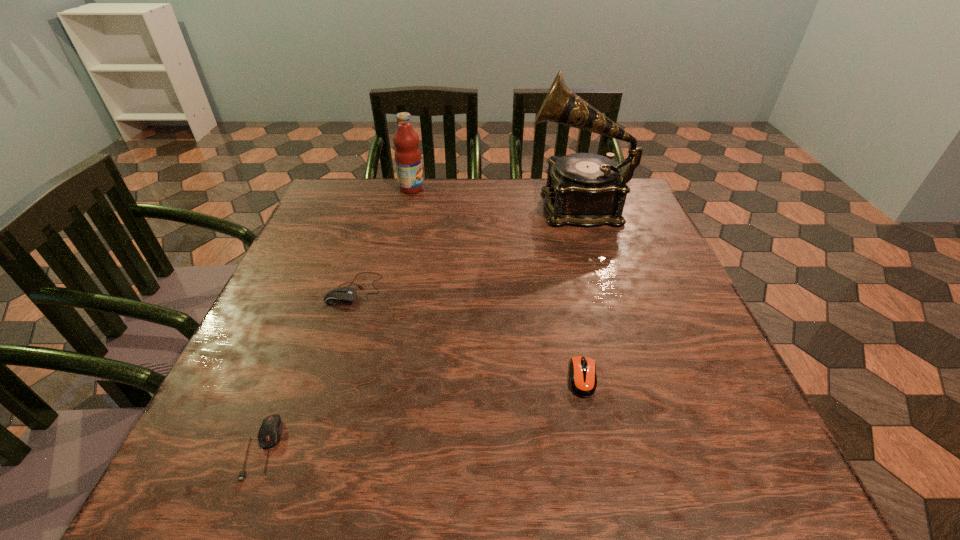
This screenshot has width=960, height=540. I want to click on vacant area situated 0.380m on the back of the third farthest object, so click(387, 186).

Find the location of a particular element. blank space located 0.050m on the front of the rightmost mouse is located at coordinates (593, 427).

Locate an element on the screen. This screenshot has height=540, width=960. vacant space located on the back of the nearest mouse is located at coordinates (300, 353).

The width and height of the screenshot is (960, 540). I want to click on phonograph record that is at the far edge, so click(583, 189).

This screenshot has width=960, height=540. Find the location of `fruit juice situated at the far edge`. fruit juice situated at the far edge is located at coordinates (407, 154).

Where is `object at the near edge`? This screenshot has height=540, width=960. object at the near edge is located at coordinates (270, 431).

Identify the location of object positioned at the right edge. (583, 189).

Identify the location of object that is at the near left corner. This screenshot has height=540, width=960. (270, 431).

The height and width of the screenshot is (540, 960). I want to click on object at the far right corner, so click(583, 189).

What are the coordinates of `vacant position at the far edge of the desktop` in the screenshot? It's located at (414, 198).